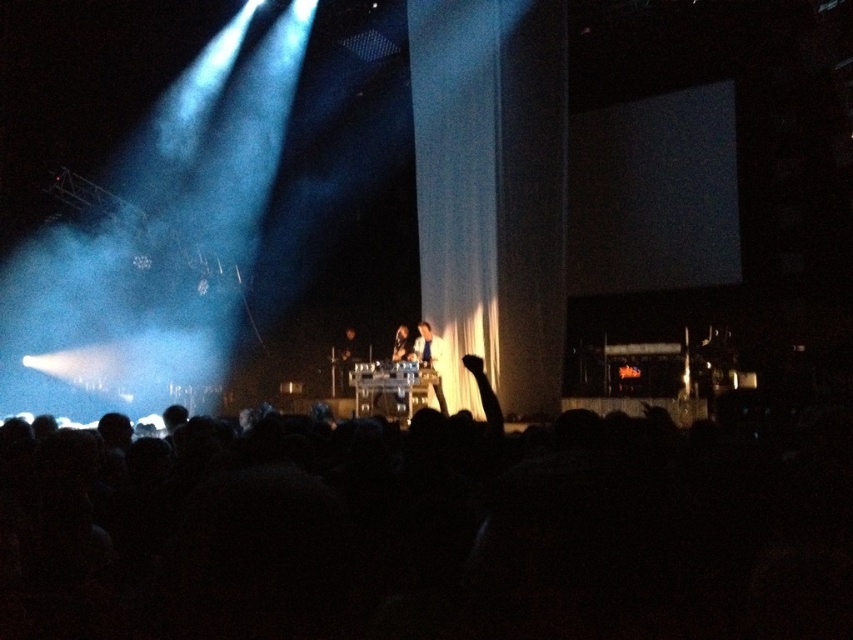
You are a stagehand who needs to place a new spotlight on the stage. You see the black matte crowd at lower center and the shiny black microphone at center. Which object is wider?

The black matte crowd at lower center is wider than the shiny black microphone at center.

You are standing at the front of the concert venue and see the point marked at coordinate (428, 531). What is located at that point?

The point at coordinate (428, 531) indicates the black matte crowd at lower center.

You are a photographer at the concert and want to capture a closeup of the shiny black jacket at center and the shiny black microphone at center. Which object should you focus on first to ensure it appears sharp in the photo?

The shiny black jacket at center is closer to the viewer than the shiny black microphone at center, so you should focus on the shiny black jacket at center first to ensure it appears sharp.